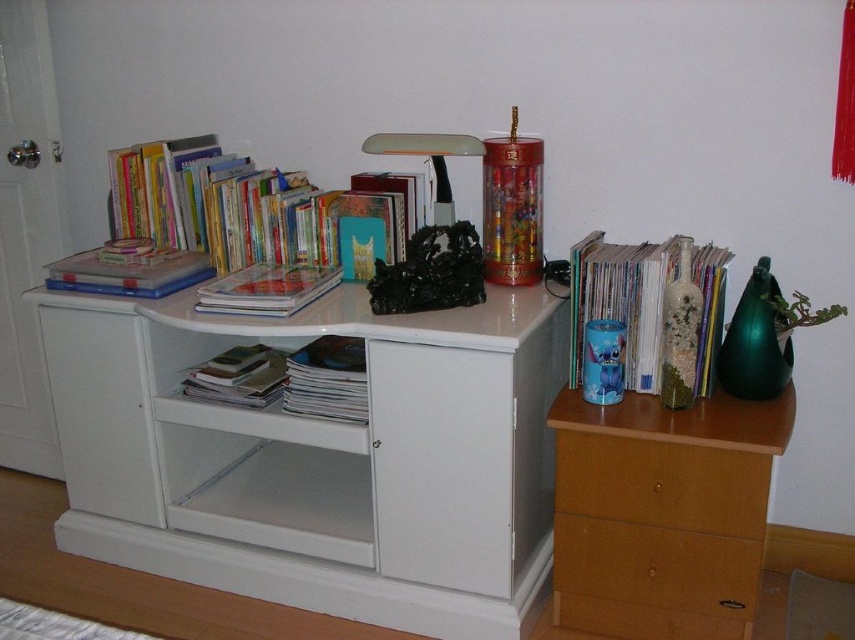
Which of these two, white paper book at center or hardcover book at upper left, stands taller?

white paper book at center is taller.

Can you confirm if white paper book at center is smaller than hardcover book at upper left?

Incorrect, white paper book at center is not smaller in size than hardcover book at upper left.

Identify the location of white paper book at center. (293, 380).

Which is in front, point (555, 536) or point (231, 161)?

Point (555, 536) is in front.

Who is shorter, wooden drawer at right or hardcover books at upper left?

hardcover books at upper left is shorter.

Is point (771, 413) positioned after point (402, 252)?

That is False.

I want to click on wooden drawer at right, so click(662, 513).

Can you confirm if matte blue cup at upper right is positioned to the right of white paper book at center?

Correct, you'll find matte blue cup at upper right to the right of white paper book at center.

Describe the element at coordinates (622, 301) in the screenshot. This screenshot has width=855, height=640. I see `matte blue cup at upper right` at that location.

Image resolution: width=855 pixels, height=640 pixels. I want to click on matte blue cup at upper right, so click(622, 301).